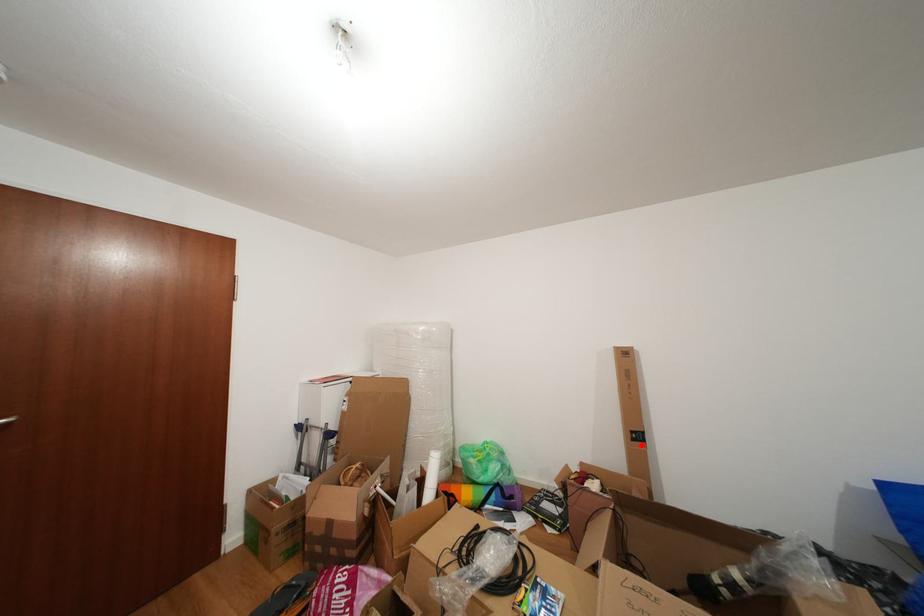
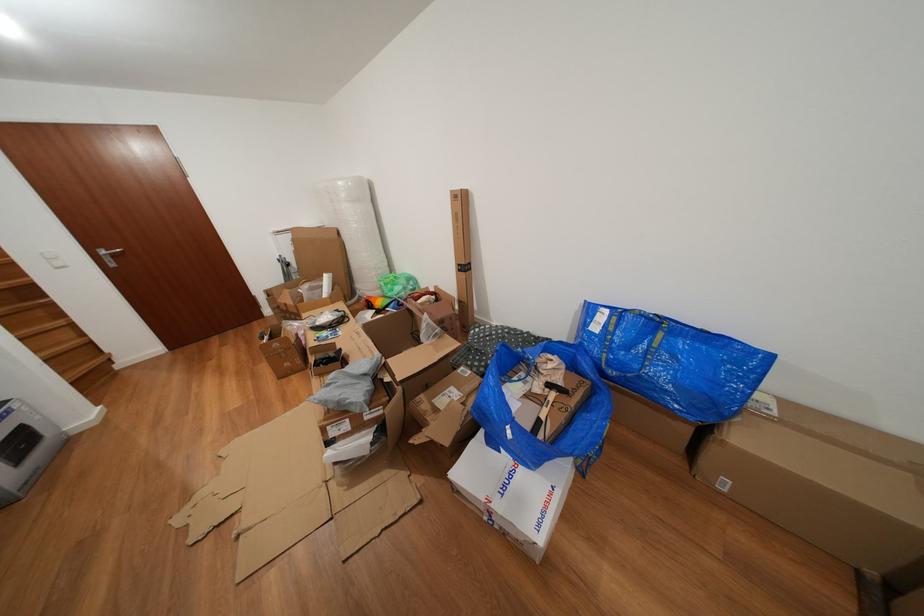
Find the pixel in the second image that matches the highlighted location in the first image.

(468, 276)